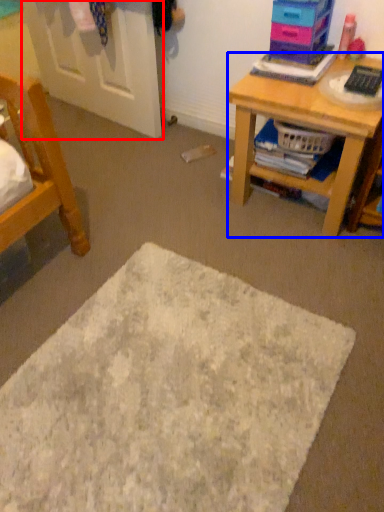
Question: Which point is closer to the camera, door (highlighted by a red box) or desk (highlighted by a blue box)?

Choices:
 (A) door
 (B) desk

Answer: (B)